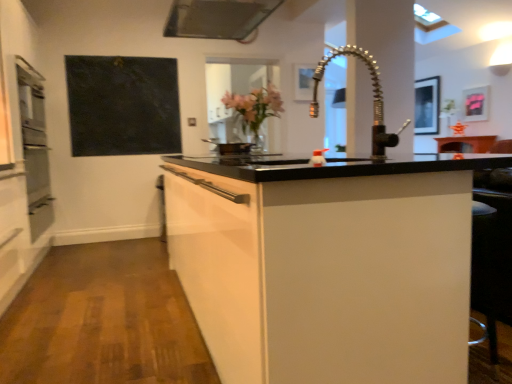
Where is `free space to the left of white glossy cabinet at center`? This screenshot has width=512, height=384. free space to the left of white glossy cabinet at center is located at coordinates (99, 319).